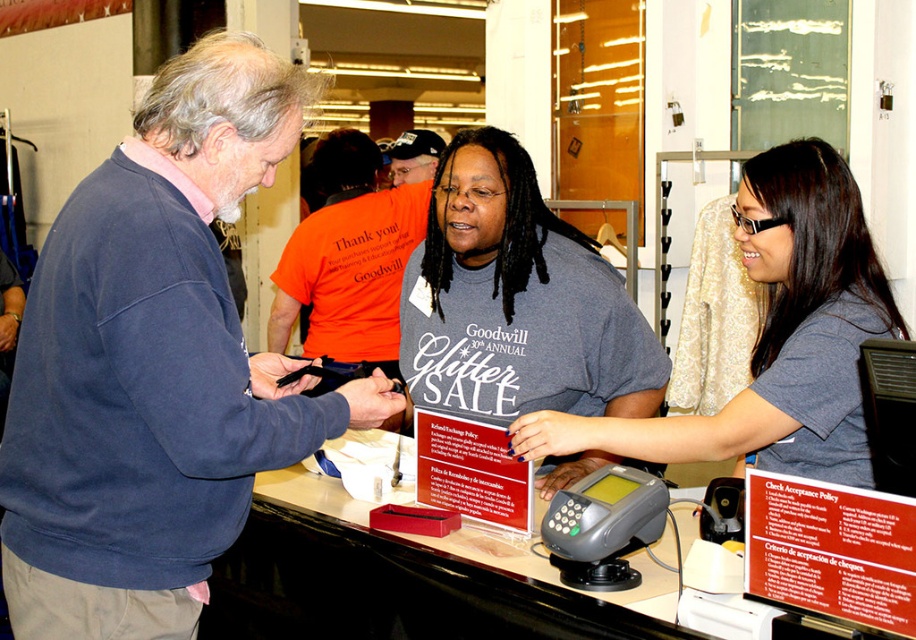
Question: Does gray matte shirt at center have a smaller size compared to orange cotton t-shirt at center?

Choices:
 (A) yes
 (B) no

Answer: (B)

Question: Which is nearer to the orange cotton shirt at center?

Choices:
 (A) blue sweatshirt at left
 (B) gray matte shirt at center
 (C) gray cotton t-shirt at center

Answer: (C)

Question: Can you confirm if gray matte shirt at center is thinner than orange cotton t-shirt at center?

Choices:
 (A) yes
 (B) no

Answer: (B)

Question: Is the position of blue sweatshirt at left more distant than that of gray matte shirt at center?

Choices:
 (A) yes
 (B) no

Answer: (B)

Question: Which point is farther to the camera?

Choices:
 (A) orange cotton t-shirt at center
 (B) blue sweatshirt at left
 (C) orange cotton shirt at center

Answer: (A)

Question: Which point appears farthest from the camera in this image?

Choices:
 (A) (426, 168)
 (B) (568, 230)
 (C) (849, 324)
 (D) (177, 492)

Answer: (A)